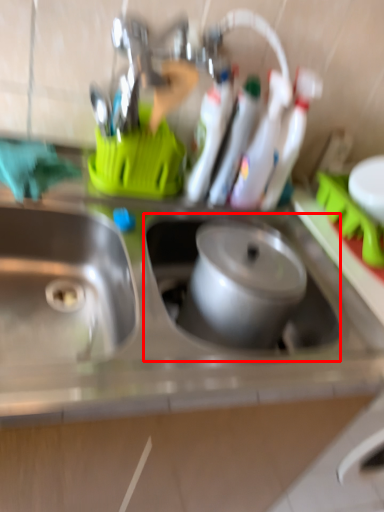
Question: From the image's perspective, where is sink (annotated by the red box) located relative to sink?

Choices:
 (A) above
 (B) below

Answer: (A)